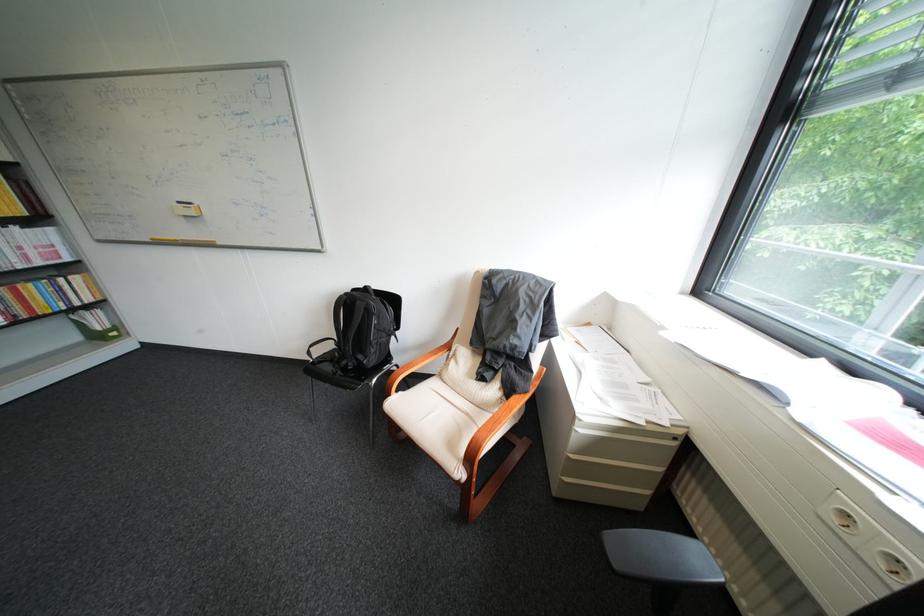
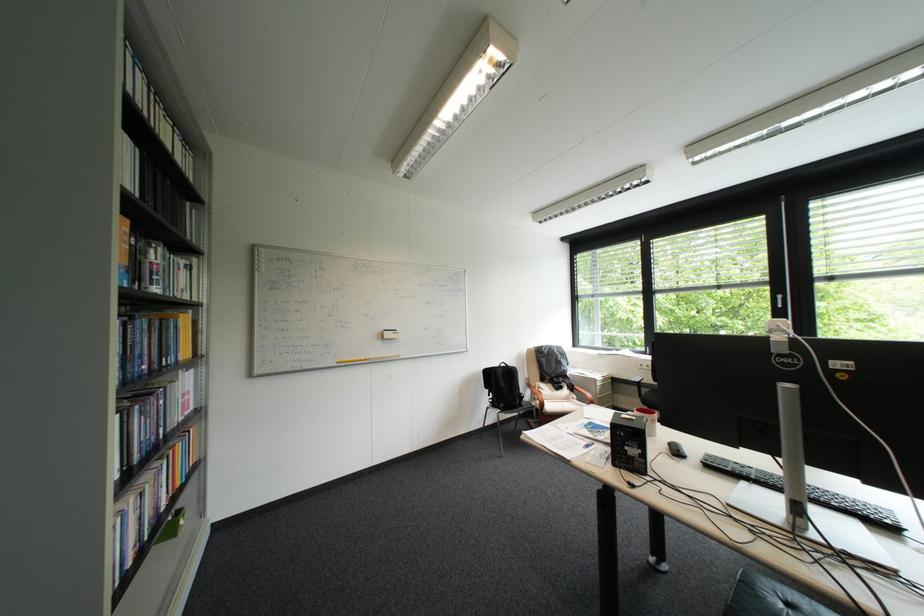
Locate, in the second image, the point that corresponds to pixel 191 203 in the first image.

(397, 331)